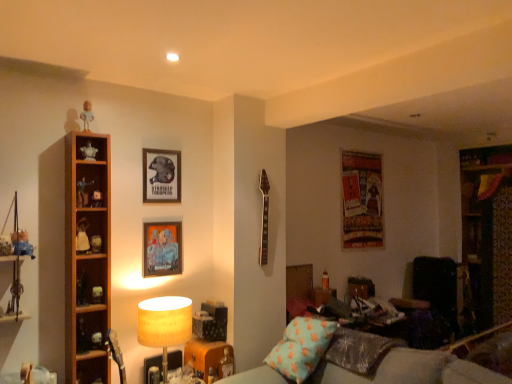
Describe the element at coordinates (88, 151) in the screenshot. The height and width of the screenshot is (384, 512). I see `white matte figurine at upper left, the seventh toy viewed from the left` at that location.

This screenshot has height=384, width=512. Identify the location of white matte figurine at upper left, the seventh toy viewed from the left. (88, 151).

Image resolution: width=512 pixels, height=384 pixels. What do you see at coordinates (161, 176) in the screenshot?
I see `matte plastic picture frame at upper center, marked as the 1th picture frame in a left-to-right arrangement` at bounding box center [161, 176].

Describe the element at coordinates (5, 245) in the screenshot. The height and width of the screenshot is (384, 512). I see `matte white figurine at left, which is counted as the 7th toy, starting from the top` at that location.

Find the location of a particular element. The height and width of the screenshot is (384, 512). textured fabric poster at upper right, the 3th picture frame in the left-to-right sequence is located at coordinates (361, 200).

Is white matte doll at left, the third toy positioned from the left, taller or shorter than cotton/polyester pillow at lower right?

Clearly, white matte doll at left, the third toy positioned from the left, is shorter compared to cotton/polyester pillow at lower right.

Are white matte doll at left, the third toy positioned from the left, and cotton/polyester pillow at lower right far apart?

white matte doll at left, the third toy positioned from the left, is far away from cotton/polyester pillow at lower right.

Which is behind, point (83, 244) or point (295, 351)?

The point (295, 351) is farther.

You are a GUI agent. You are given a task and a screenshot of the screen. Output one action in this format:
    pyautogui.click(x=<x>, y=<y>)
    Task: Click on the pillow on the right of the white matte doll at left, the 7th toy ordered from the bottom
    This screenshot has width=512, height=384.
    Given the screenshot: What is the action you would take?
    pyautogui.click(x=301, y=347)

Is wooden shelf at left at the left side of matte white figurine at center, which is the eleventh toy from left to right?

Correct, you'll find wooden shelf at left to the left of matte white figurine at center, which is the eleventh toy from left to right.

Does wooden shelf at left lie in front of matte white figurine at center, the 1th toy in the right-to-left sequence?

Yes, it is.

Which is in front, point (67, 339) or point (220, 373)?

The point (67, 339) is closer.

Based on the photo, is wooden shelf at left facing towards matte white figurine at center, which is the eleventh toy from left to right?

No, wooden shelf at left is not turned towards matte white figurine at center, which is the eleventh toy from left to right.

Is matte black figurine at left, which is the eighth toy in right-to-left order, positioned behind matte plastic picture frame at upper center, marked as the 1th picture frame in a left-to-right arrangement?

No, it is in front of matte plastic picture frame at upper center, marked as the 1th picture frame in a left-to-right arrangement.

Consider the image. Which is correct: matte black figurine at left, which is the 9th toy from top to bottom, is inside matte plastic picture frame at upper center, marked as the 1th picture frame in a left-to-right arrangement, or outside of it?

matte black figurine at left, which is the 9th toy from top to bottom, exists outside the volume of matte plastic picture frame at upper center, marked as the 1th picture frame in a left-to-right arrangement.

Considering the points (81, 275) and (163, 156), which point is in front, point (81, 275) or point (163, 156)?

The point (81, 275) is closer.

Is matte black figurine at left, positioned as the third toy in bottom-to-top order, to the left or to the right of matte plastic picture frame at upper center, marked as the 1th picture frame in a left-to-right arrangement, in the image?

matte black figurine at left, positioned as the third toy in bottom-to-top order, is positioned on matte plastic picture frame at upper center, marked as the 1th picture frame in a left-to-right arrangement,'s left side.

Can you confirm if white matte figurine at left, the tenth toy in the left-to-right sequence, is bigger than white matte figurine at upper left, arranged as the sixth toy when viewed from the left?

No.

In terms of height, does white matte figurine at left, the 10th toy viewed from the top, look taller or shorter compared to white matte figurine at upper left, the first toy viewed from the top?

Considering their sizes, white matte figurine at left, the 10th toy viewed from the top, has less height than white matte figurine at upper left, the first toy viewed from the top.

Can we say white matte figurine at left, which is counted as the second toy, starting from the right, lies outside white matte figurine at upper left, arranged as the sixth toy when viewed from the left?

Indeed, white matte figurine at left, which is counted as the second toy, starting from the right, is completely outside white matte figurine at upper left, arranged as the sixth toy when viewed from the left.

From the image's perspective, relative to matte plastic action figure at left, placed as the seventh toy when sorted from right to left, is matte beige lampshade at lower left above or below?

matte beige lampshade at lower left is below matte plastic action figure at left, placed as the seventh toy when sorted from right to left.

Based on the photo, is matte beige lampshade at lower left placed right next to matte plastic action figure at left, placed as the seventh toy when sorted from right to left?

No, matte beige lampshade at lower left is not touching matte plastic action figure at left, placed as the seventh toy when sorted from right to left.

Based on the photo, considering the relative sizes of matte beige lampshade at lower left and matte plastic action figure at left, marked as the 5th toy in a left-to-right arrangement, in the image provided, is matte beige lampshade at lower left taller than matte plastic action figure at left, marked as the 5th toy in a left-to-right arrangement,?

Indeed, matte beige lampshade at lower left has a greater height compared to matte plastic action figure at left, marked as the 5th toy in a left-to-right arrangement.

Which is correct: matte beige lampshade at lower left is inside matte plastic action figure at left, the third toy positioned from the top, or outside of it?

matte beige lampshade at lower left is spatially situated outside matte plastic action figure at left, the third toy positioned from the top.

Is black leather swivel chair at lower right at the back of matte plastic action figure at left, placed as the seventh toy when sorted from right to left?

matte plastic action figure at left, placed as the seventh toy when sorted from right to left, is not turned away from black leather swivel chair at lower right.

Considering the sizes of objects matte plastic action figure at left, marked as the 5th toy in a left-to-right arrangement, and black leather swivel chair at lower right in the image provided, who is taller, matte plastic action figure at left, marked as the 5th toy in a left-to-right arrangement, or black leather swivel chair at lower right?

With more height is black leather swivel chair at lower right.

Considering the relative positions of matte plastic action figure at left, the third toy positioned from the top, and black leather swivel chair at lower right in the image provided, is matte plastic action figure at left, the third toy positioned from the top, to the right of black leather swivel chair at lower right from the viewer's perspective?

No, matte plastic action figure at left, the third toy positioned from the top, is not to the right of black leather swivel chair at lower right.

Does point (85, 194) appear closer or farther from the camera than point (416, 266)?

Point (85, 194) appears to be closer to the viewer than point (416, 266).

Which of these two, white matte doll at left, the 9th toy when ordered from right to left, or textured fabric poster at upper right, which ranks as the 1th picture frame in right-to-left order, is smaller?

white matte doll at left, the 9th toy when ordered from right to left, is smaller.

Is white matte doll at left, the 7th toy ordered from the bottom, positioned with its back to textured fabric poster at upper right, the 3th picture frame in the left-to-right sequence?

That's not correct — white matte doll at left, the 7th toy ordered from the bottom, is not looking away from textured fabric poster at upper right, the 3th picture frame in the left-to-right sequence.

Is white matte doll at left, the third toy positioned from the left, in front of textured fabric poster at upper right, acting as the 3th picture frame starting from the front?

Yes, white matte doll at left, the third toy positioned from the left, is closer to the viewer.

Image resolution: width=512 pixels, height=384 pixels. There is a white matte doll at left, the third toy positioned from the left. In order to click on the 1st picture frame above it (from a real-world perspective) in this screenshot , I will do `click(361, 200)`.

At what (x,y) coordinates should I click in order to perform the action: click on the 6th toy positioned above the cotton/polyester pillow at lower right (from a real-world perspective). Please return your answer as a coordinate pair (x, y). Image resolution: width=512 pixels, height=384 pixels. Looking at the image, I should click on (82, 236).

The width and height of the screenshot is (512, 384). I want to click on shelf in front of the matte white figurine at center, which ranks as the eleventh toy in top-to-bottom order, so click(87, 262).

Looking at the image, which one is located closer to matte beige lampshade at lower left, matte white figurine at left, which ranks as the 4th toy in top-to-bottom order, or white matte figurine at left, which is counted as the second toy, starting from the right?

white matte figurine at left, which is counted as the second toy, starting from the right.

Which object lies nearer to the anchor point matte plastic picture frame at center, which is the second picture frame in right-to-left order, textured fabric couch at lower right or white matte figurine at upper left, the seventh toy viewed from the left?

Among the two, white matte figurine at upper left, the seventh toy viewed from the left, is located nearer to matte plastic picture frame at center, which is the second picture frame in right-to-left order.

Which object lies nearer to the anchor point textured fabric couch at lower right, matte white figurine at left, which is counted as the 10th toy, starting from the right, or matte beige lampshade at lower left?

Based on the image, matte beige lampshade at lower left appears to be nearer to textured fabric couch at lower right.

Estimate the real-world distances between objects in this image. Which object is closer to matte beige lampshade at lower left, white matte figurine at upper left, the first toy viewed from the top, or matte plastic picture frame at center, positioned as the second picture frame in left-to-right order?

The object closer to matte beige lampshade at lower left is matte plastic picture frame at center, positioned as the second picture frame in left-to-right order.

Based on their spatial positions, is white glossy figurine at left, which is counted as the 4th toy, starting from the bottom, or black leather swivel chair at lower right closer to matte white figurine at left, the fifth toy when ordered from bottom to top?

Among the two, white glossy figurine at left, which is counted as the 4th toy, starting from the bottom, is located nearer to matte white figurine at left, the fifth toy when ordered from bottom to top.

Based on their spatial positions, is matte plastic picture frame at center, which is the second picture frame in right-to-left order, or matte white figurine at left, arranged as the 2th toy when viewed from the left, further from cotton/polyester pillow at lower right?

Based on the image, matte white figurine at left, arranged as the 2th toy when viewed from the left, appears to be further to cotton/polyester pillow at lower right.

Looking at the image, which one is located further to wooden shelf at left, matte plastic picture frame at center, which is the second picture frame in right-to-left order, or textured fabric couch at lower right?

textured fabric couch at lower right.

Estimate the real-world distances between objects in this image. Which object is closer to matte white figurine at left, which ranks as the sixth toy in bottom-to-top order, textured fabric poster at upper right, which ranks as the 1th picture frame in right-to-left order, or matte white figurine at left, which is counted as the 7th toy, starting from the top?

The object closer to matte white figurine at left, which ranks as the sixth toy in bottom-to-top order, is matte white figurine at left, which is counted as the 7th toy, starting from the top.

Identify the location of table lamp located between wooden shelf at left and textured fabric couch at lower right in the left-right direction. Image resolution: width=512 pixels, height=384 pixels. (164, 324).

The width and height of the screenshot is (512, 384). I want to click on shelf located between matte white figurine at left, which is the eleventh toy in right-to-left order, and black leather swivel chair at lower right in the left-right direction, so click(x=87, y=262).

I want to click on table lamp between white matte figurine at upper left, positioned as the fifth toy in right-to-left order, and cotton/polyester pillow at lower right from top to bottom, so tap(164, 324).

At what (x,y) coordinates should I click in order to perform the action: click on table lamp that lies between white matte figurine at upper left, positioned as the fifth toy in right-to-left order, and matte white figurine at center, the 1th toy in the right-to-left sequence, from top to bottom. Please return your answer as a coordinate pair (x, y). Looking at the image, I should click on (164, 324).